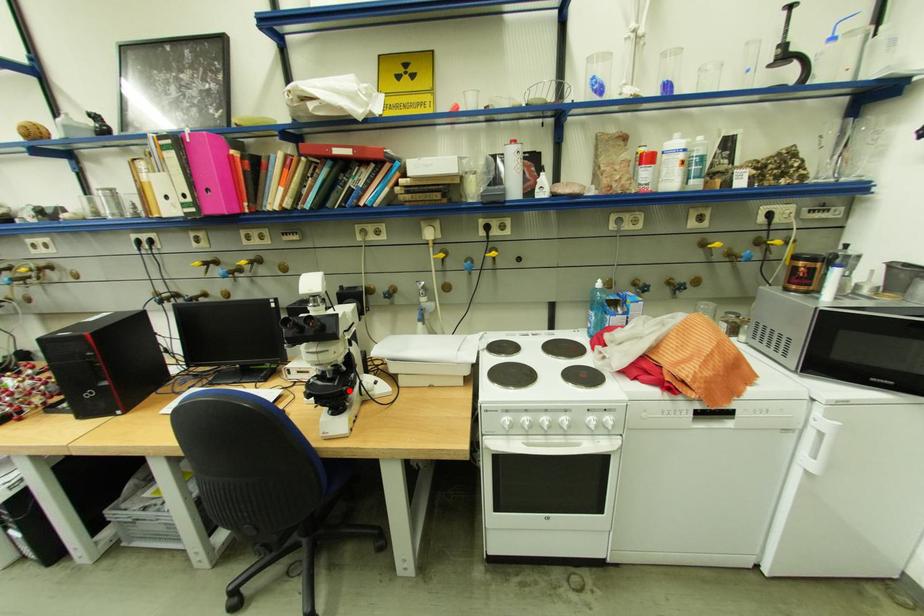
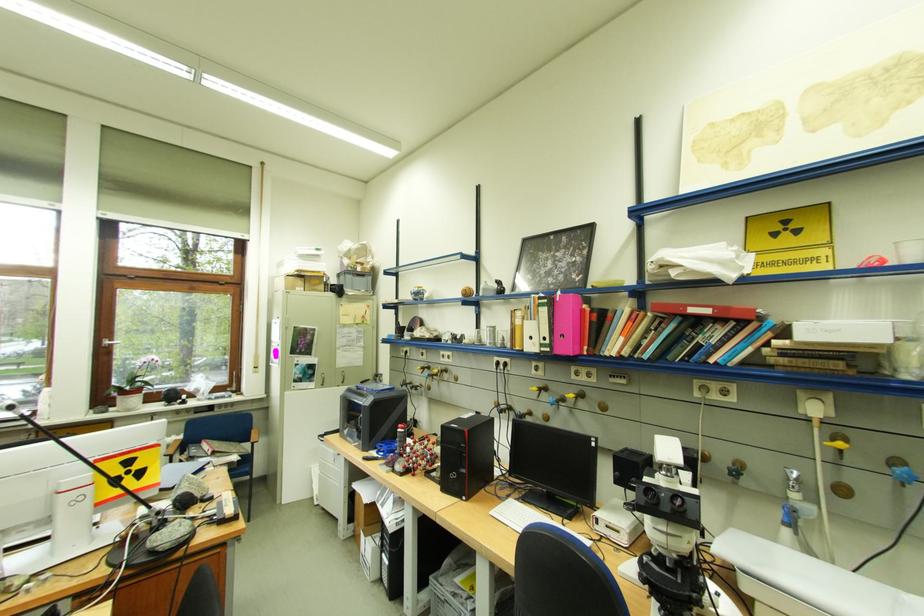
Where in the second image is the point corresponding to the highlighted location from the first image?

(698, 594)